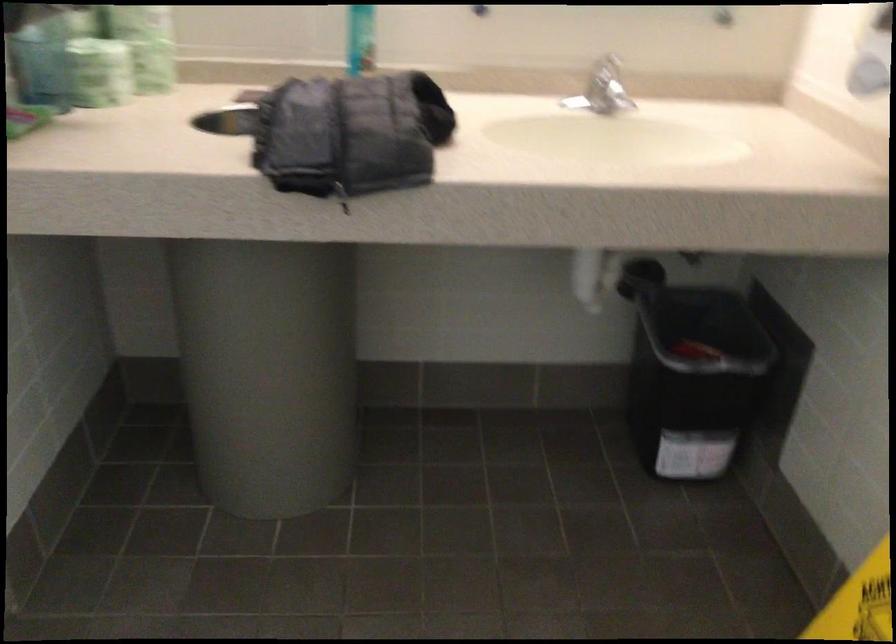
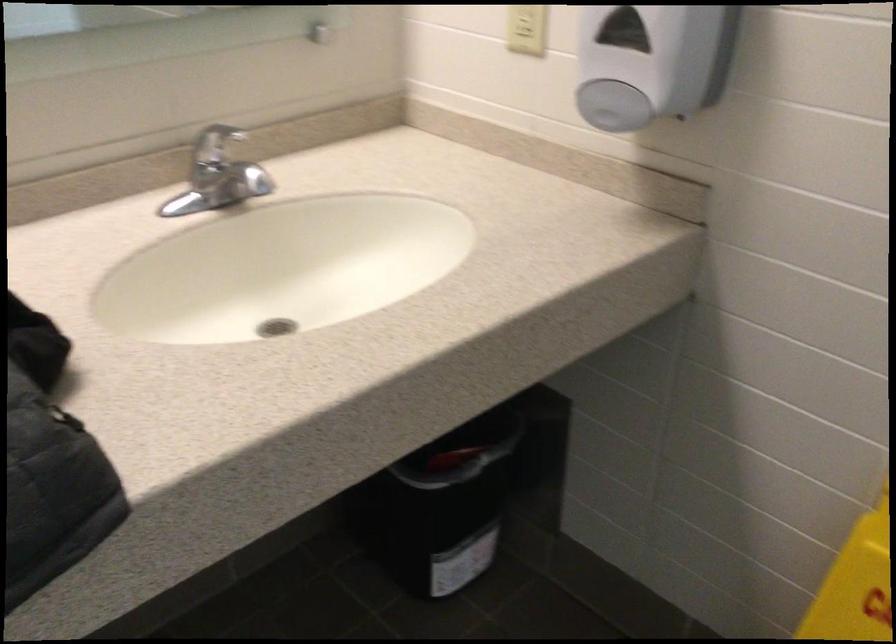
Question: The camera is either moving clockwise (left) or counter-clockwise (right) around the object. The first image is from the beginning of the video and the second image is from the end. Is the camera moving left or right when shooting the video?

Choices:
 (A) Left
 (B) Right

Answer: (A)